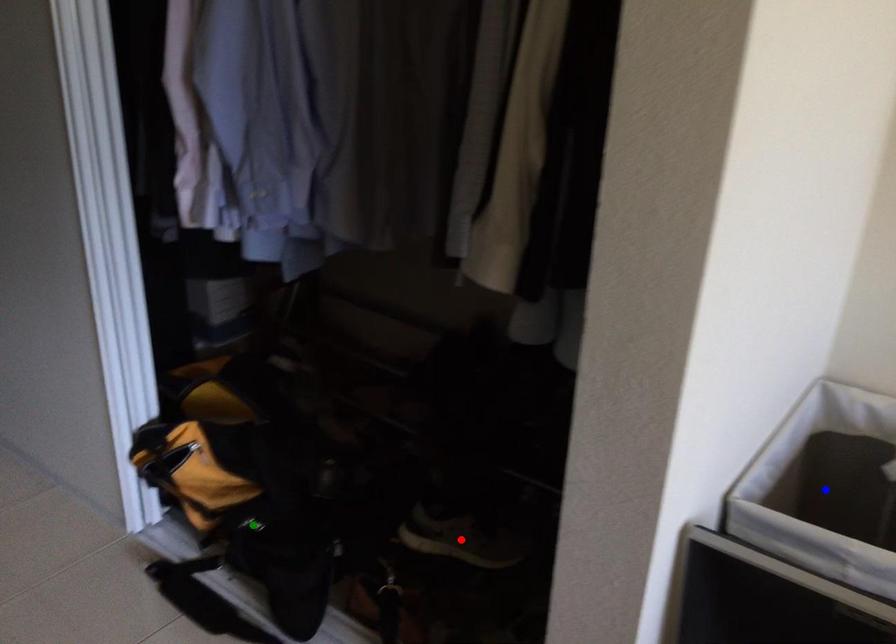
In the scene shown: Order these from nearest to farthest:
blue point | green point | red point

green point → red point → blue point